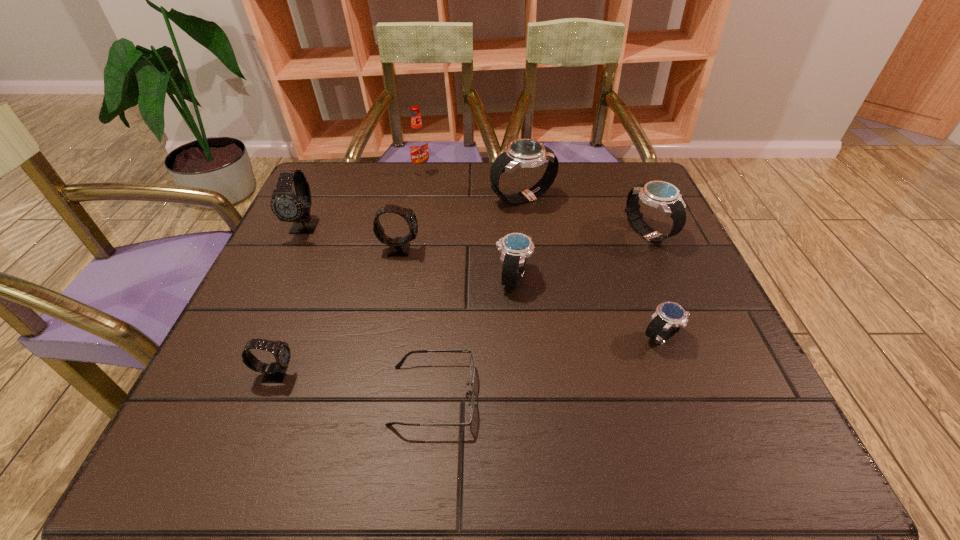
Image resolution: width=960 pixels, height=540 pixels. In order to click on gray watch identified as the third closest to the root beer in this screenshot , I will do `click(273, 373)`.

Select which gray watch is the second closest to the third nearest silver watch. Please provide its 2D coordinates. Your answer should be formatted as a tuple, i.e. [(x, y)], where the tuple contains the x and y coordinates of a point satisfying the conditions above.

[(273, 373)]

The image size is (960, 540). I want to click on vacant point that satisfies the following two spatial constraints: 1. on the front side of the tallest object; 2. on the left side of the nearest silver watch, so click(392, 337).

Locate an element on the screen. The height and width of the screenshot is (540, 960). free space that satisfies the following two spatial constraints: 1. on the face of the third nearest watch; 2. on the right side of the biggest gray watch is located at coordinates (281, 278).

In order to click on vacant space that satisfies the following two spatial constraints: 1. on the face of the third nearest watch; 2. on the right side of the biggest gray watch in this screenshot , I will do `click(281, 278)`.